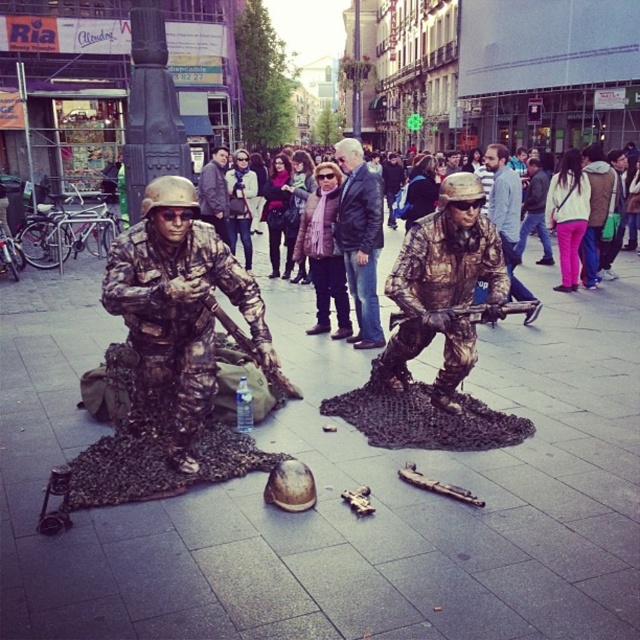
Is bronze statue at center behind camouflage fabric soldier at center?

No, it is in front of camouflage fabric soldier at center.

Can you confirm if bronze statue at center is positioned to the left of camouflage fabric soldier at center?

Yes, bronze statue at center is to the left of camouflage fabric soldier at center.

Does point (444, 356) lie in front of point (486, 168)?

That is True.

Where is `bronze statue at center`? This screenshot has height=640, width=640. bronze statue at center is located at coordinates (442, 288).

Measure the distance between leather jacket at center and camera.

They are 8.75 meters apart.

Consider the image. Between leather jacket at center and camouflage fabric soldier at center, which one appears on the left side from the viewer's perspective?

From the viewer's perspective, leather jacket at center appears more on the left side.

You are a GUI agent. You are given a task and a screenshot of the screen. Output one action in this format:
    pyautogui.click(x=<x>, y=<y>)
    Task: Click on the leather jacket at center
    This screenshot has width=640, height=640.
    Given the screenshot: What is the action you would take?
    pyautogui.click(x=360, y=237)

Where is `leather jacket at center`? The height and width of the screenshot is (640, 640). leather jacket at center is located at coordinates pyautogui.click(x=360, y=237).

From the picture: Which is more to the left, camouflage paint soldier at left or bronze statue at center?

camouflage paint soldier at left

Can you confirm if camouflage paint soldier at left is positioned below bronze statue at center?

Correct, camouflage paint soldier at left is located below bronze statue at center.

Is point (173, 420) in front of point (428, 257)?

Yes, point (173, 420) is closer to viewer.

The image size is (640, 640). What are the coordinates of `camouflage paint soldier at left` in the screenshot? It's located at (177, 314).